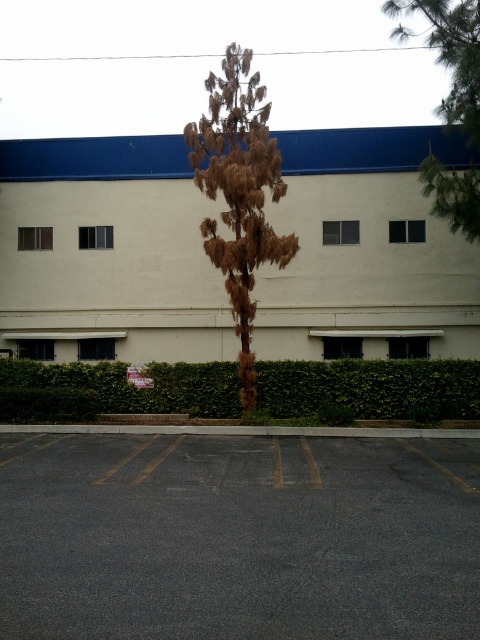
You are a gardener who needs to water both the green leafy hedge at lower center and the brown textured tree at center. You have a watering can that can hold enough water for 4 meters of travel. Starting from the hedge, can you reach the tree without needing to refill your watering can?

The green leafy hedge at lower center and the brown textured tree at center are 4.40 meters apart from each other. Since the watering can can hold enough water for 4 meters of travel, the gardener cannot reach the tree without refilling the watering can because the distance is greater than 4 meters.

You are a landscape architect designing a new parking lot layout. You need to place a new bench between the brown textured tree at center and the brown textured tree at upper right. Which tree should the bench be closer to if you want it to be near the smaller tree?

The bench should be closer to the brown textured tree at center because it is the smaller one compared to the brown textured tree at upper right.

You are a delivery person who needs to park your 6.5 meter long truck in the gray asphalt parking lot at lower center. The brown textured tree at upper right is in the way. Can you park your truck without hitting the tree?

The distance between the gray asphalt parking lot at lower center and the brown textured tree at upper right is 10.49 meters. Since the truck is 6.5 meters long, there is enough space to park without hitting the tree as the distance is greater than the truck length.